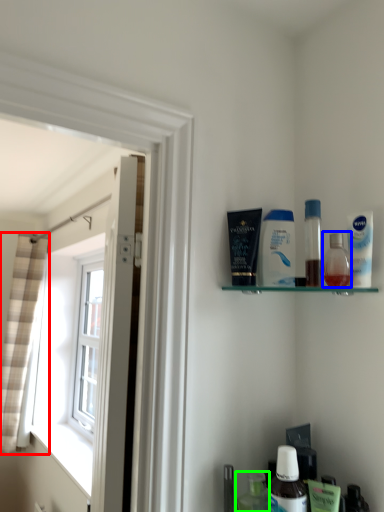
Question: Estimate the real-world distances between objects in this image. Which object is closer to curtain (highlighted by a red box), toiletry (highlighted by a blue box) or toiletry (highlighted by a green box)?

Choices:
 (A) toiletry
 (B) toiletry

Answer: (B)